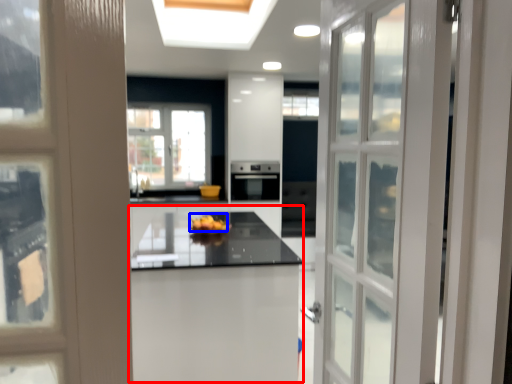
Question: Among these objects, which one is nearest to the camera, table (highlighted by a red box) or fruit (highlighted by a blue box)?

Choices:
 (A) table
 (B) fruit

Answer: (A)